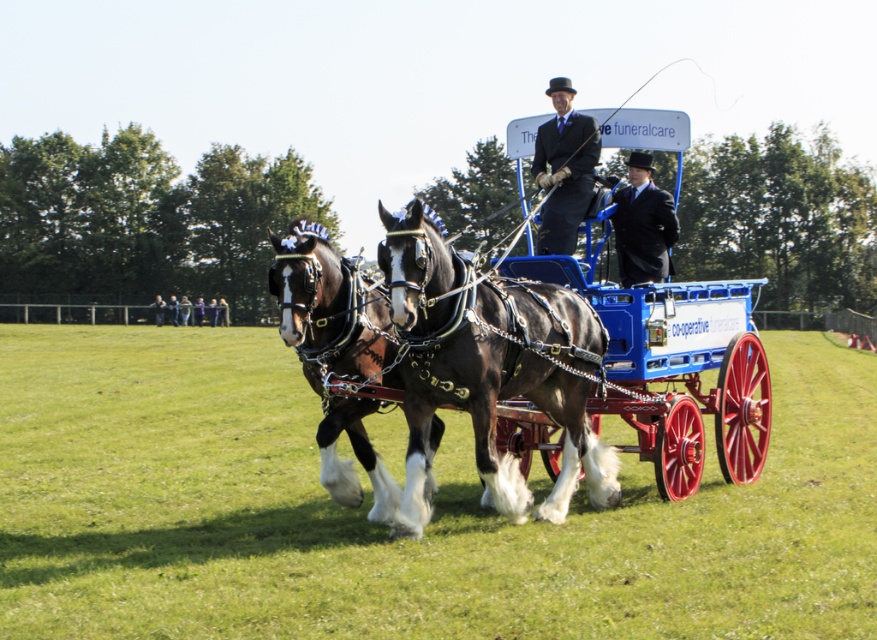
Measure the distance between point (446,365) and camera.

Point (446,365) and camera are 7.13 meters apart from each other.

Does shiny black horse at center appear on the left side of smooth leather jacket at center?

No, shiny black horse at center is not to the left of smooth leather jacket at center.

Does point (417, 374) come in front of point (223, 310)?

Yes, point (417, 374) is closer to viewer.

Image resolution: width=877 pixels, height=640 pixels. Find the location of `shiny black horse at center`. shiny black horse at center is located at coordinates (490, 369).

Between brown glossy horse at center and matte black suit at center, which one appears on the right side from the viewer's perspective?

Positioned to the right is matte black suit at center.

Is brown glossy horse at center below matte black suit at center?

Yes, brown glossy horse at center is below matte black suit at center.

The image size is (877, 640). In order to click on brown glossy horse at center in this screenshot , I will do `click(387, 528)`.

Can you confirm if shiny blue cart at center is smaller than dark blue suit at center?

No, shiny blue cart at center is not smaller than dark blue suit at center.

Who is shorter, shiny blue cart at center or dark blue suit at center?

dark blue suit at center

What do you see at coordinates (560, 372) in the screenshot? I see `shiny blue cart at center` at bounding box center [560, 372].

Where is `shiny blue cart at center`? Image resolution: width=877 pixels, height=640 pixels. shiny blue cart at center is located at coordinates (560, 372).